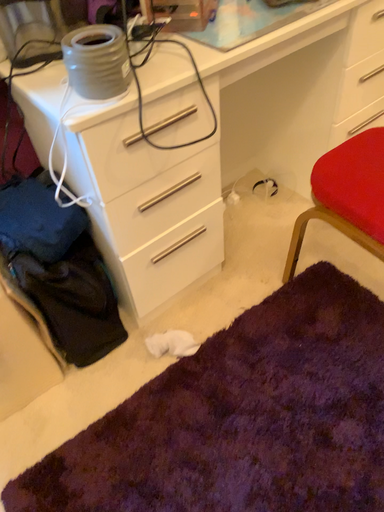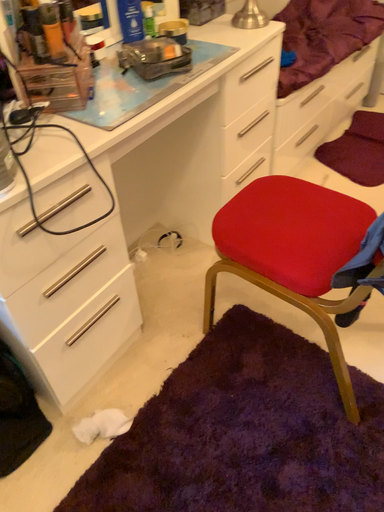
Question: How did the camera likely rotate when shooting the video?

Choices:
 (A) rotated upward
 (B) rotated downward

Answer: (A)